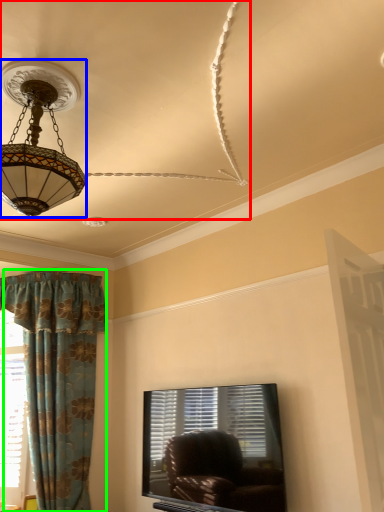
Question: Which object is positioned farthest from fan (highlighted by a red box)? Select from lamp (highlighted by a blue box) and curtain (highlighted by a green box).

Choices:
 (A) lamp
 (B) curtain

Answer: (B)